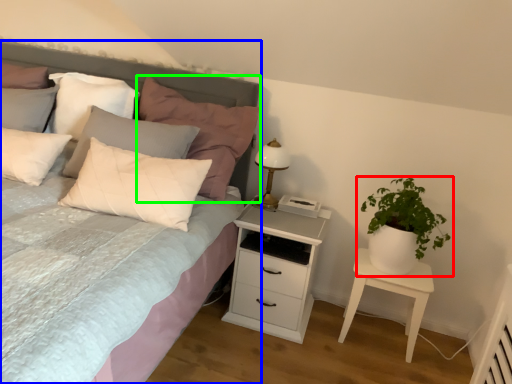
Question: Based on their relative distances, which object is nearer to houseplant (highlighted by a red box)? Choose from bed (highlighted by a blue box) and pillow (highlighted by a green box).

Choices:
 (A) bed
 (B) pillow

Answer: (B)